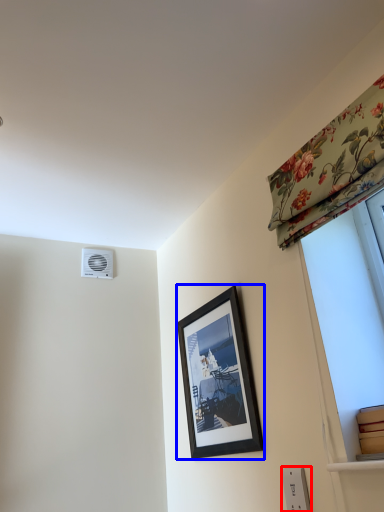
Question: Which of the following is the closest to the observer, electric outlet (highlighted by a red box) or picture frame (highlighted by a blue box)?

Choices:
 (A) electric outlet
 (B) picture frame

Answer: (A)